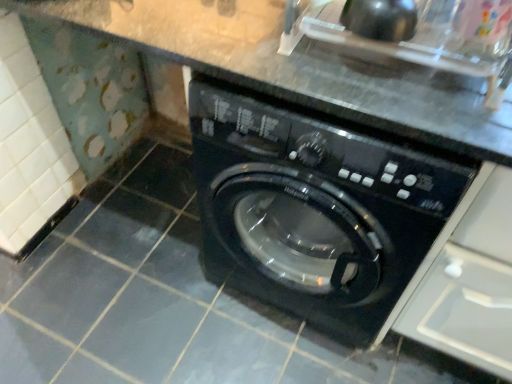
Question: Is point (436, 13) closer or farther from the camera than point (458, 342)?

Choices:
 (A) closer
 (B) farther

Answer: (A)

Question: Based on their sizes in the image, would you say black glossy sink at upper right is bigger or smaller than white plastic drawer at upper right?

Choices:
 (A) small
 (B) big

Answer: (A)

Question: Estimate the real-world distances between objects in this image. Which object is closer to the white plastic drawer at upper right?

Choices:
 (A) black glossy sink at upper right
 (B) black glossy washing machine at center

Answer: (B)

Question: Considering the real-world distances, which object is closest to the black glossy washing machine at center?

Choices:
 (A) black glossy sink at upper right
 (B) white plastic drawer at upper right

Answer: (B)